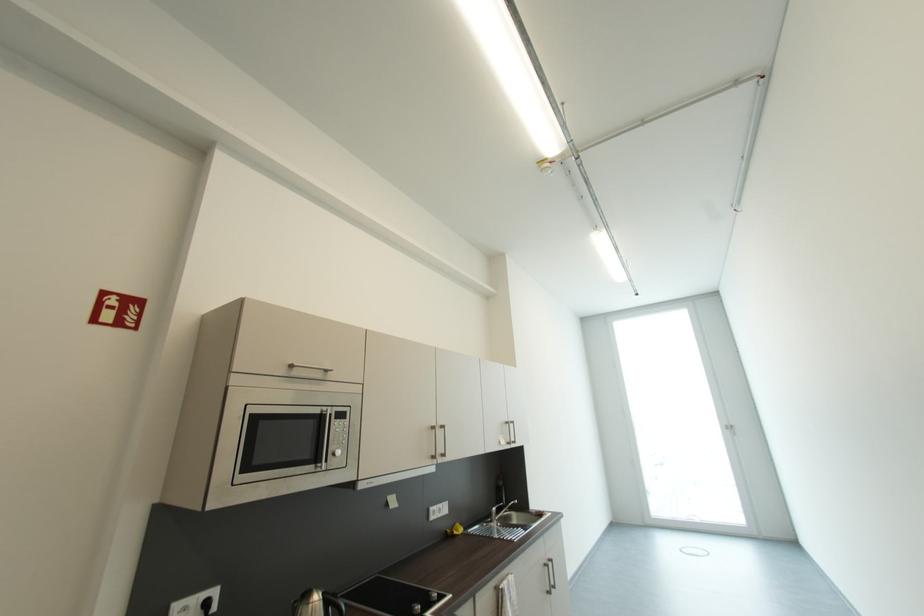
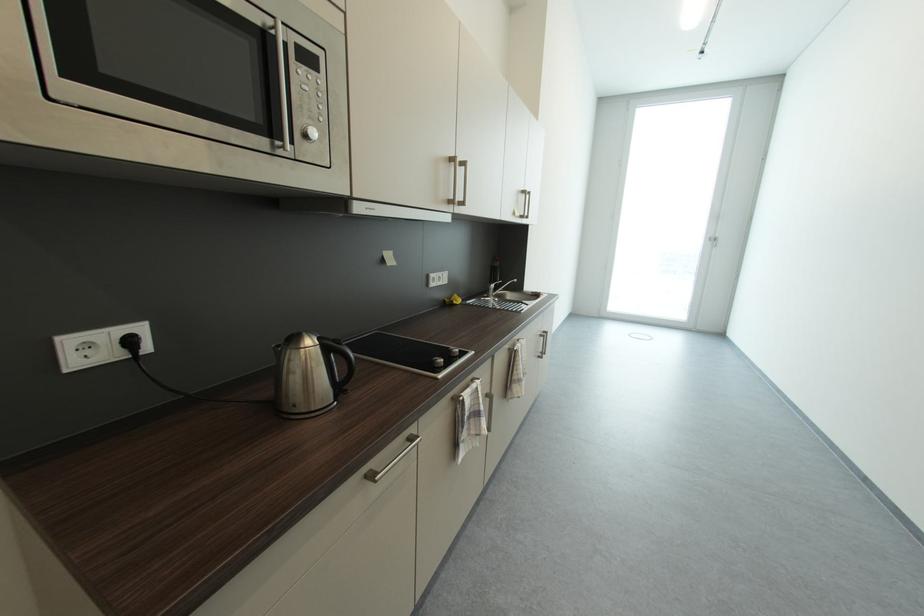
In the second image, find the point that corresponds to the point at 454,533 in the first image.

(453, 302)